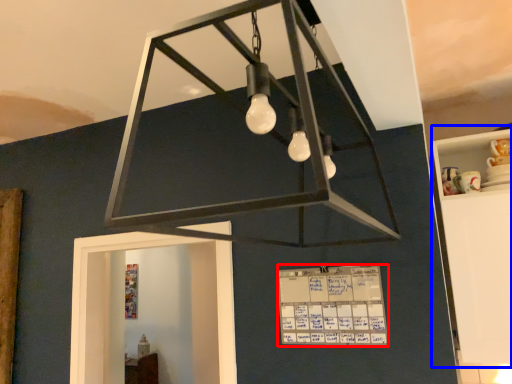
Question: Which point is closer to the camera, writing (highlighted by a red box) or furniture (highlighted by a blue box)?

Choices:
 (A) writing
 (B) furniture

Answer: (A)